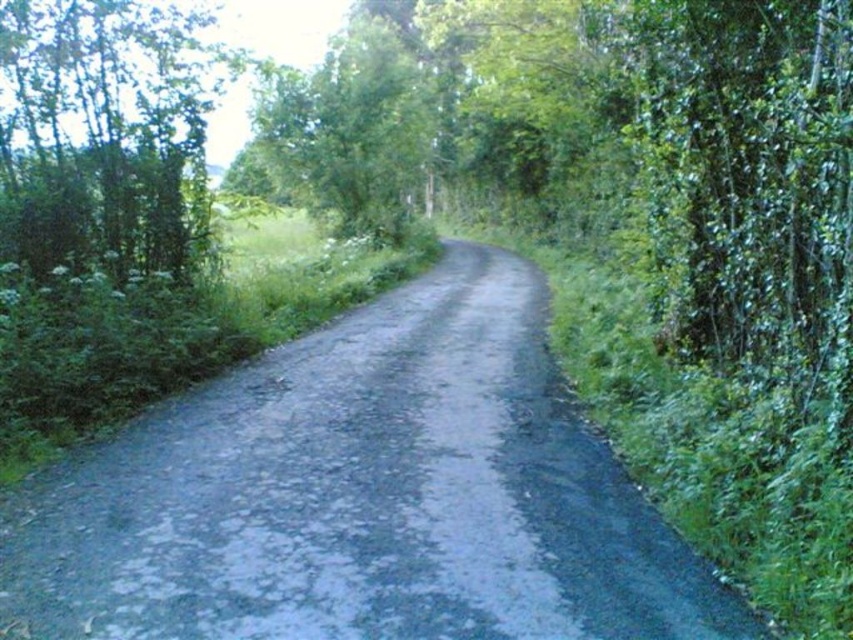
Does gray asphalt road at center appear on the right side of green leafy tree at left?

Yes, gray asphalt road at center is to the right of green leafy tree at left.

Between gray asphalt road at center and green leafy tree at left, which one is positioned higher?

green leafy tree at left is above.

Does point (601, 604) lie behind point (169, 168)?

No, (601, 604) is closer to viewer.

Identify the location of gray asphalt road at center. This screenshot has height=640, width=853. (363, 496).